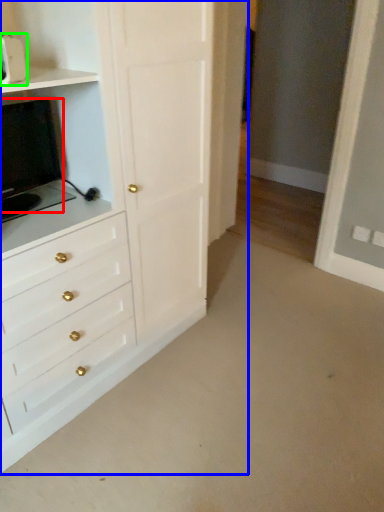
Question: Considering the real-world distances, which object is closest to appliance (highlighted by a red box)? chest of drawers (highlighted by a blue box) or appliance (highlighted by a green box).

Choices:
 (A) chest of drawers
 (B) appliance

Answer: (A)